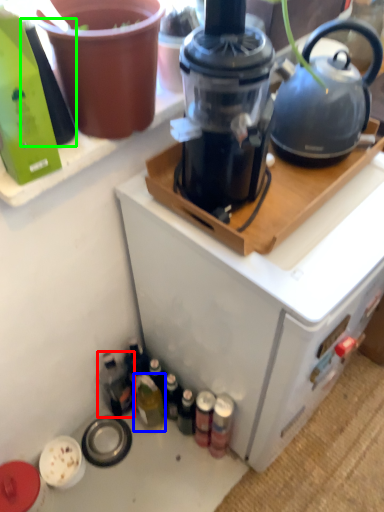
Question: Based on their relative distances, which object is nearer to bottle (highlighted by a red box)? Choose from bottle (highlighted by a blue box) and bottle (highlighted by a green box).

Choices:
 (A) bottle
 (B) bottle

Answer: (A)